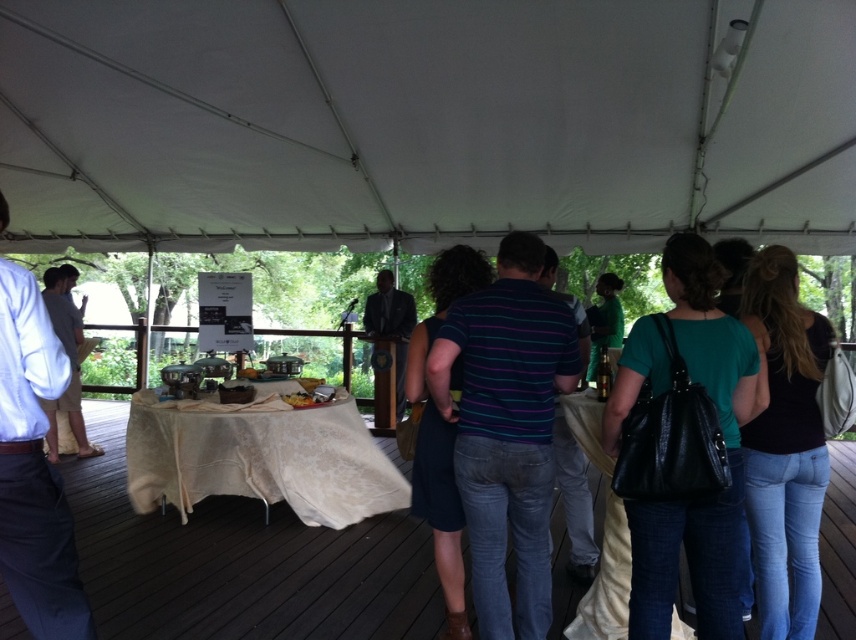
Is point (28, 312) in front of point (81, 422)?

Yes, it is in front of point (81, 422).

Does light blue shirt at left have a greater width compared to light brown shorts at left?

Incorrect, light blue shirt at left's width does not surpass light brown shorts at left's.

Where is `light blue shirt at left`? light blue shirt at left is located at coordinates (34, 468).

Is white fabric canopy at upper center in front of dark suit at center?

Yes, white fabric canopy at upper center is closer to the viewer.

You are a GUI agent. You are given a task and a screenshot of the screen. Output one action in this format:
    pyautogui.click(x=<x>, y=<y>)
    Task: Click on the white fabric canopy at upper center
    
    Given the screenshot: What is the action you would take?
    pyautogui.click(x=425, y=122)

Where is `white fabric canopy at upper center`? The image size is (856, 640). white fabric canopy at upper center is located at coordinates (425, 122).

Is striped cotton shirt at center below light blue shirt at left?

Correct, striped cotton shirt at center is located below light blue shirt at left.

Between point (533, 518) and point (33, 358), which one is positioned behind?

Point (533, 518)

You are a GUI agent. You are given a task and a screenshot of the screen. Output one action in this format:
    pyautogui.click(x=<x>, y=<y>)
    Task: Click on the striped cotton shirt at center
    The height and width of the screenshot is (640, 856).
    Given the screenshot: What is the action you would take?
    pyautogui.click(x=507, y=429)